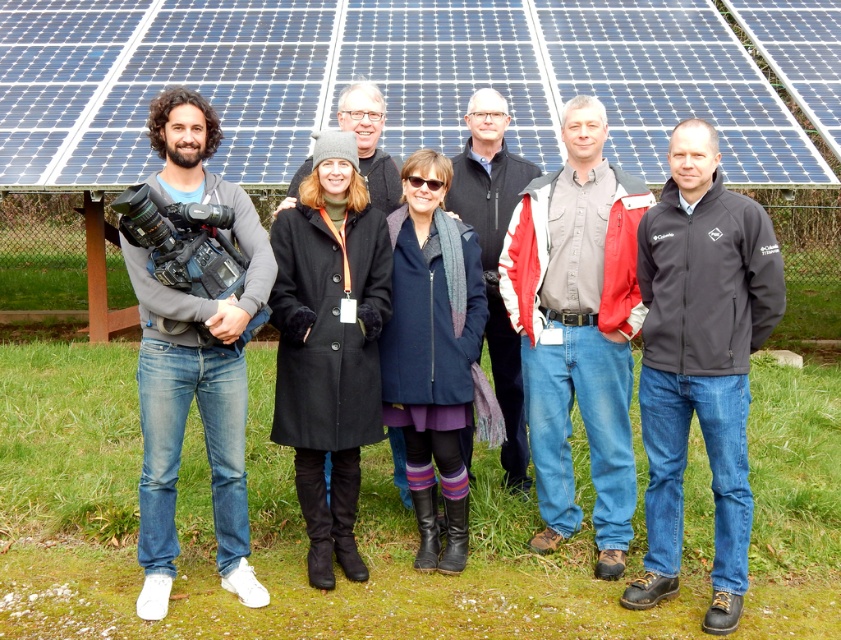
You are a photographer positioned behind the group of seven individuals in front of the solar panels. You need to capture a clear photo of the dark gray softshell jacket at center and the black wool coat at center. Which one will appear lower in the photo?

The dark gray softshell jacket at center is located below the black wool coat at center, so in the photo, the dark gray softshell jacket at center will appear lower than the black wool coat at center.

You are a photographer standing in front of the solar panels and need to take a photo of both the dark gray softshell jacket at center and the black softshell jacket at center. Which jacket will appear larger in the photo?

The dark gray softshell jacket at center will appear larger in the photo because it is closer to the viewer than the black softshell jacket at center.

In the scene shown: You are a photographer standing at the position of the camera holder. You want to take a photo of the dark gray softshell jacket at center. Is the jacket within your camera lens range of 4 meters?

The distance between dark gray softshell jacket at center and the camera is 3.96 meters, so yes, the jacket is within the 4 meters range.